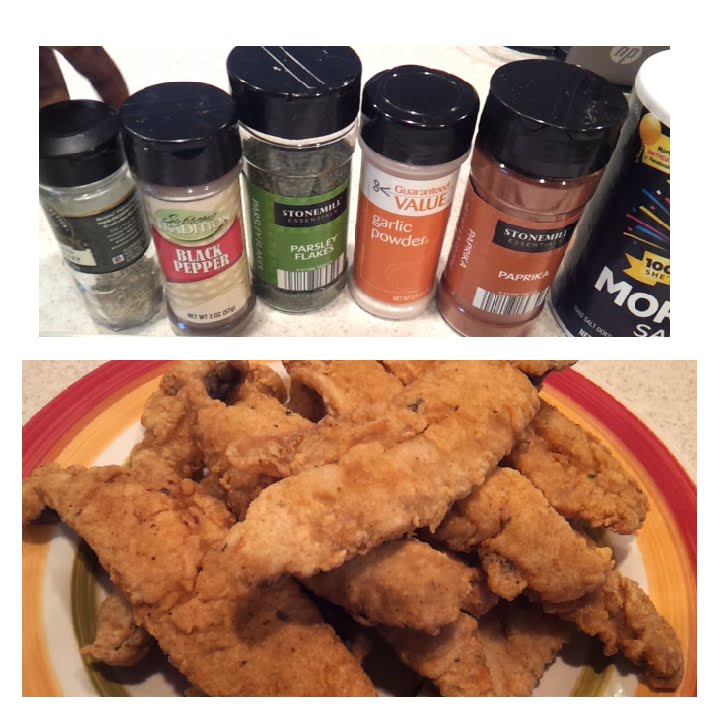
Locate an element on the screen. speckled counter top is located at coordinates tap(359, 323), tap(657, 402).